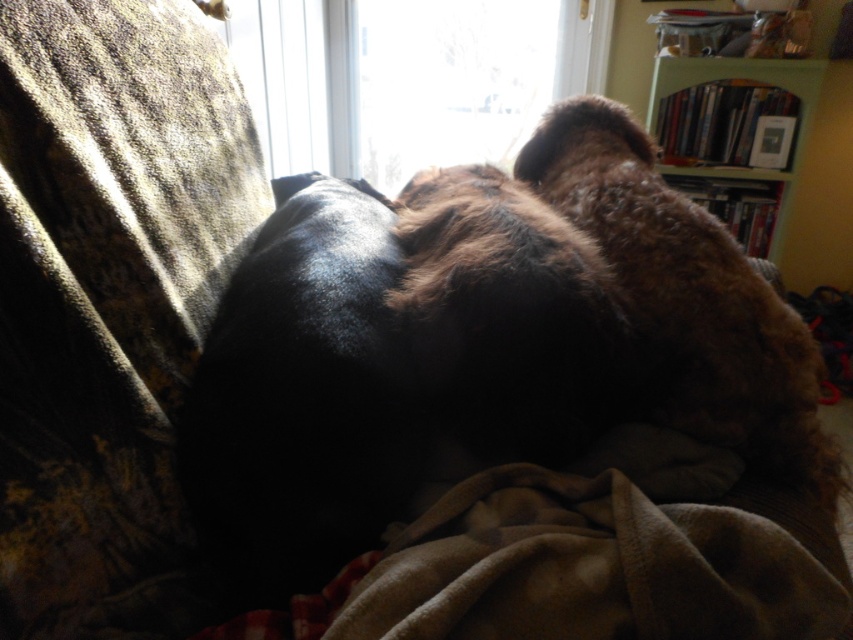
Question: Is brown fuzzy dog at center above fuzzy brown dog at center?

Choices:
 (A) yes
 (B) no

Answer: (A)

Question: Which of the following is the closest to the observer?

Choices:
 (A) (788, 202)
 (B) (706, 433)
 (C) (322, 100)

Answer: (B)

Question: Which point is closer to the camera taking this photo?

Choices:
 (A) (666, 419)
 (B) (451, 116)
 (C) (723, 170)

Answer: (A)

Question: Can you confirm if brown fuzzy dog at center is wider than transparent glass window at upper center?

Choices:
 (A) no
 (B) yes

Answer: (A)

Question: Can you confirm if brown fuzzy dog at center is smaller than fuzzy brown dog at center?

Choices:
 (A) yes
 (B) no

Answer: (A)

Question: Among these points, which one is nearest to the camera?

Choices:
 (A) (408, 115)
 (B) (540, 262)
 (C) (775, 65)
 (D) (786, 461)

Answer: (B)